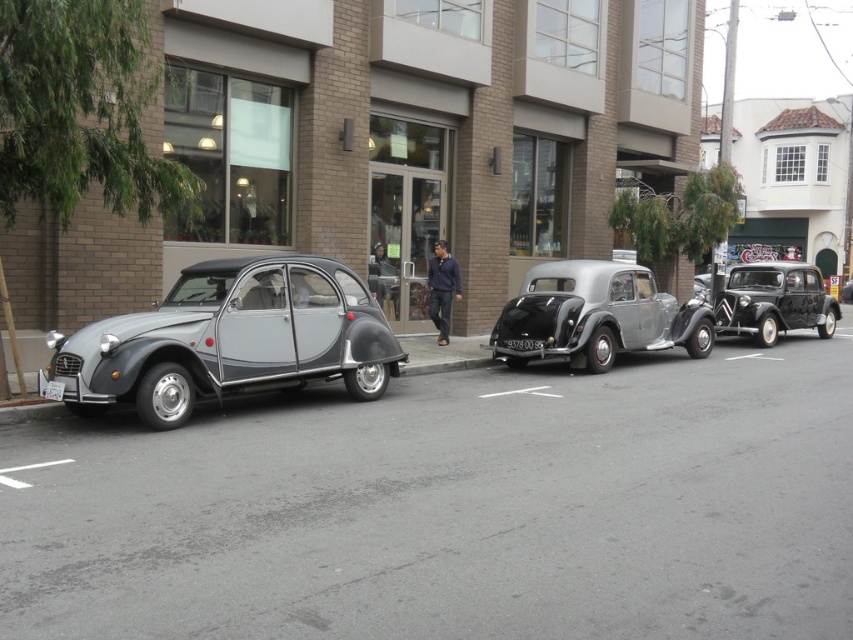
Question: Is navy blue sweater at center smaller than black plastic license plate at center?

Choices:
 (A) no
 (B) yes

Answer: (A)

Question: Among these objects, which one is farthest from the camera?

Choices:
 (A) white plastic license plate at center
 (B) metallic silver car at center
 (C) black plastic license plate at center
 (D) metallic gray car at left

Answer: (C)

Question: Can you confirm if navy blue sweater at center is positioned to the left of black plastic license plate at center?

Choices:
 (A) yes
 (B) no

Answer: (A)

Question: Among these points, which one is farthest from the camera?

Choices:
 (A) (717, 304)
 (B) (526, 346)
 (C) (186, 324)
 (D) (590, 364)

Answer: (A)

Question: Is metallic silver car at center positioned in front of black glossy sedan at right?

Choices:
 (A) yes
 (B) no

Answer: (A)

Question: Which of these objects is positioned closest to the white plastic license plate at center?

Choices:
 (A) shiny silver car at center
 (B) metallic gray car at left
 (C) navy blue sweater at center
 (D) black glossy sedan at right

Answer: (B)